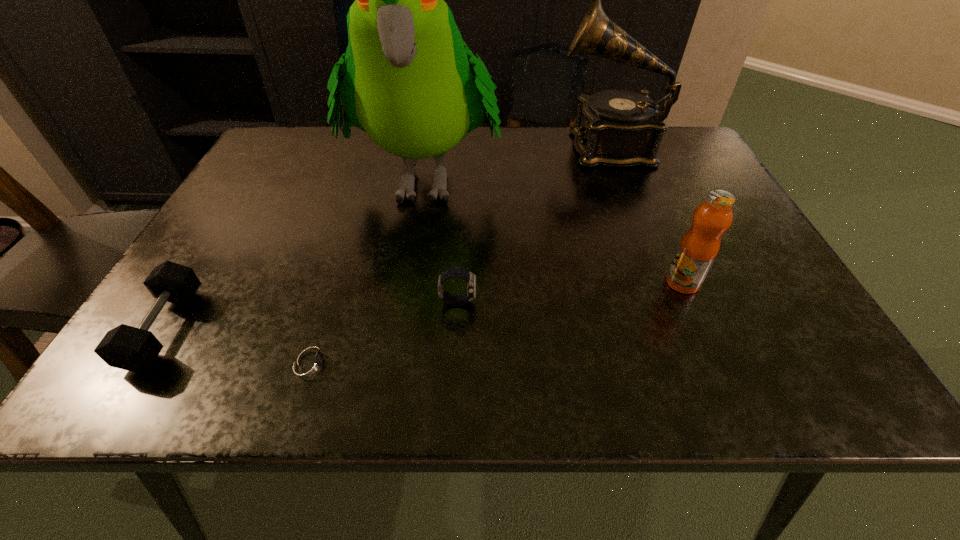
This screenshot has height=540, width=960. In order to click on the tallest object in this screenshot , I will do `click(406, 80)`.

The width and height of the screenshot is (960, 540). I want to click on phonograph record, so click(x=617, y=128).

The width and height of the screenshot is (960, 540). Find the location of `fruit juice`. fruit juice is located at coordinates (699, 246).

Find the location of a particular element. the farther watch is located at coordinates (456, 271).

Identify the location of the right watch. (456, 271).

The height and width of the screenshot is (540, 960). I want to click on dumbbell, so click(125, 347).

Find the location of a particular element. The image size is (960, 540). the nearer watch is located at coordinates (310, 362).

I want to click on the shorter watch, so click(x=310, y=362).

This screenshot has height=540, width=960. In order to click on vacant region located 0.360m on the beak of the tallest object in this screenshot , I will do `click(393, 391)`.

This screenshot has height=540, width=960. I want to click on free space located on the horn of the phonograph record, so click(472, 146).